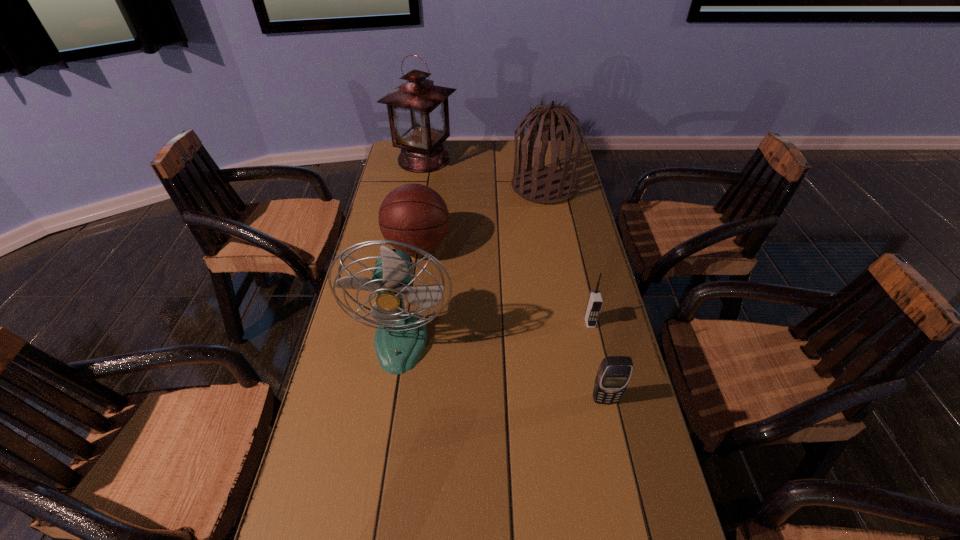
Locate an element on the screen. This screenshot has height=540, width=960. vacant space located 0.080m on the right of the third farthest object is located at coordinates (475, 246).

You are a GUI agent. You are given a task and a screenshot of the screen. Output one action in this format:
    pyautogui.click(x=<x>, y=<y>)
    Task: Click on the vacant space located 0.390m on the front-facing side of the farther cellular telephone
    This screenshot has width=960, height=540.
    Given the screenshot: What is the action you would take?
    pyautogui.click(x=624, y=475)

I want to click on blank space located 0.190m on the front face of the nearest object, so click(625, 489).

Locate an element on the screen. object situated at the far edge is located at coordinates (418, 111).

Locate an element on the screen. The width and height of the screenshot is (960, 540). oil lamp positioned at the left edge is located at coordinates (418, 111).

Locate an element on the screen. fan present at the left edge is located at coordinates (401, 336).

Where is `basketball that is positioned at the left edge`? basketball that is positioned at the left edge is located at coordinates (415, 214).

Locate an element on the screen. birdcage that is at the right edge is located at coordinates (545, 185).

In order to click on object positioned at the far left corner in this screenshot , I will do (418, 111).

This screenshot has height=540, width=960. In order to click on vacant space at the far edge in this screenshot , I will do `click(502, 166)`.